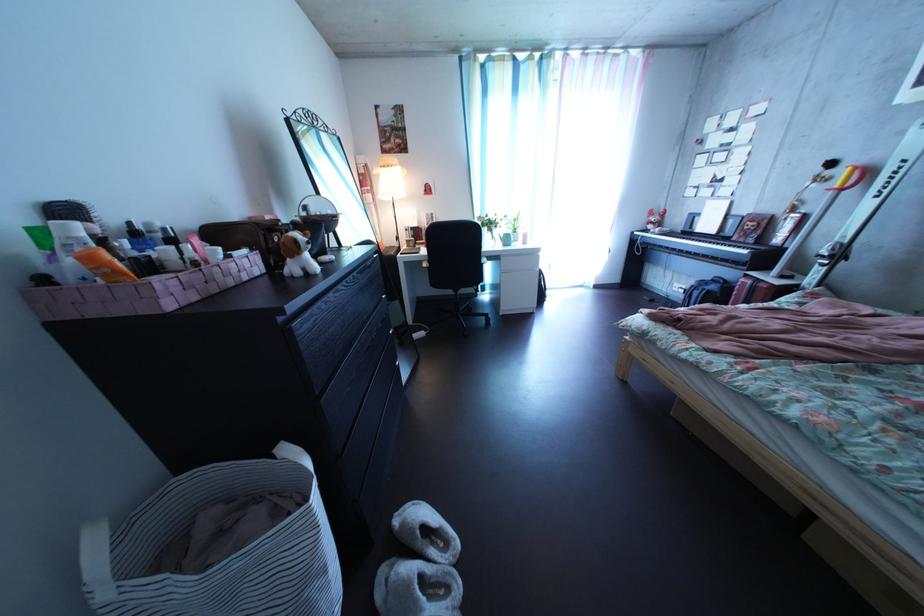
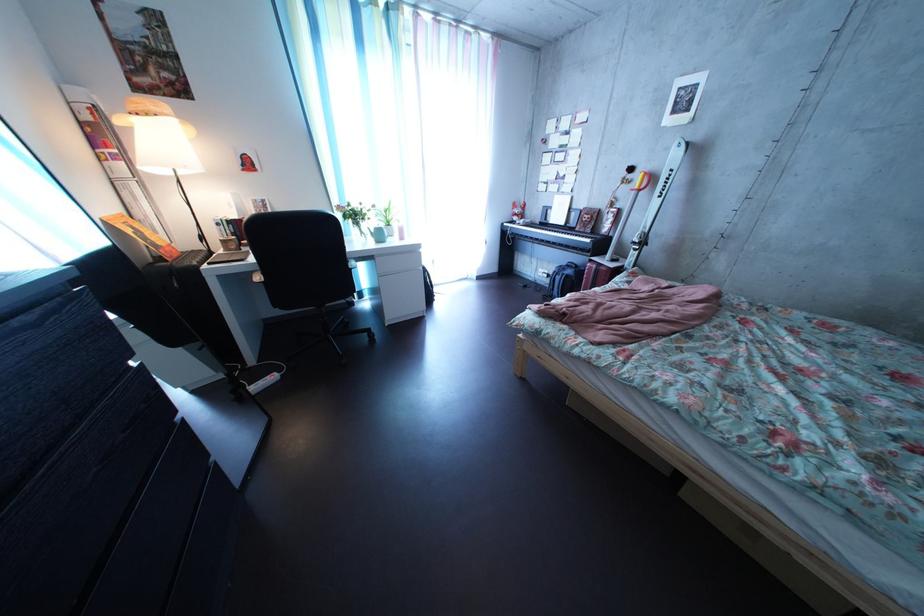
In the second image, find the point that corresponds to (x=857, y=198) in the first image.

(653, 199)